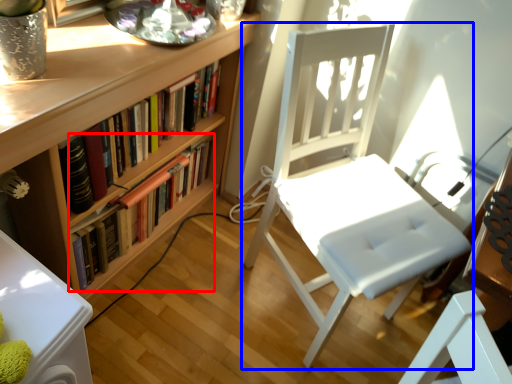
Question: Which object appears closest to the camera in this image, book (highlighted by a red box) or chair (highlighted by a blue box)?

Choices:
 (A) book
 (B) chair

Answer: (B)